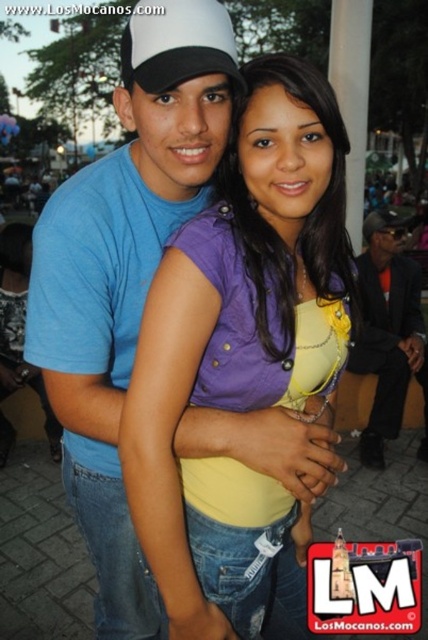
Question: Estimate the real-world distances between objects in this image. Which object is closer to the blue cotton t-shirt at upper left?

Choices:
 (A) orange fabric suit at right
 (B) purple denim shirt at center

Answer: (B)

Question: Which is nearer to the blue cotton t-shirt at upper left?

Choices:
 (A) purple denim shirt at center
 (B) white matte baseball cap at upper center
 (C) orange fabric suit at right

Answer: (A)

Question: Is purple denim shirt at center bigger than orange fabric suit at right?

Choices:
 (A) yes
 (B) no

Answer: (B)

Question: Can you confirm if purple denim shirt at center is positioned to the left of blue cotton t-shirt at upper left?

Choices:
 (A) no
 (B) yes

Answer: (A)

Question: In this image, where is purple denim shirt at center located relative to white matte baseball cap at upper center?

Choices:
 (A) above
 (B) below

Answer: (B)

Question: Which point is closer to the camera?

Choices:
 (A) (68, 454)
 (B) (207, 58)
 (C) (168, 304)

Answer: (B)